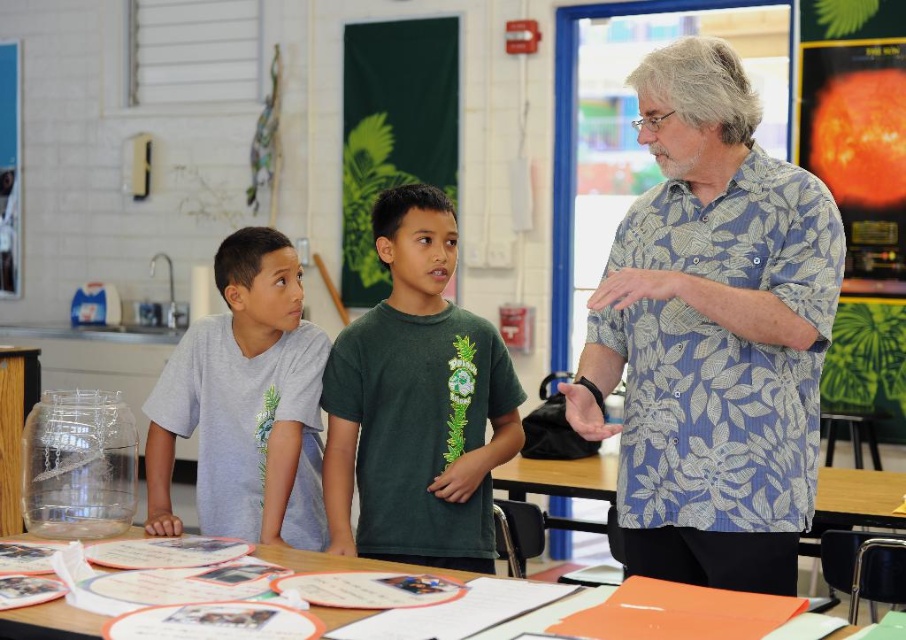
Looking at this image, does blue floral shirt at center appear on the right side of green matte shirt at center?

Indeed, blue floral shirt at center is positioned on the right side of green matte shirt at center.

Which of these two, blue floral shirt at center or green matte shirt at center, stands taller?

blue floral shirt at center is taller.

Who is more distant from viewer, (627, 512) or (376, 454)?

Positioned behind is point (376, 454).

This screenshot has width=906, height=640. I want to click on blue floral shirt at center, so click(x=712, y=333).

Does point (235, 280) come closer to viewer compared to point (272, 556)?

No, it is behind (272, 556).

Locate an element on the screen. The height and width of the screenshot is (640, 906). gray matte shirt at center is located at coordinates (244, 403).

Is point (811, 333) less distant than point (89, 627)?

No, it is behind (89, 627).

Which of these two, blue floral shirt at center or orange paper at lower center, stands taller?

blue floral shirt at center

What do you see at coordinates (712, 333) in the screenshot?
I see `blue floral shirt at center` at bounding box center [712, 333].

I want to click on blue floral shirt at center, so click(x=712, y=333).